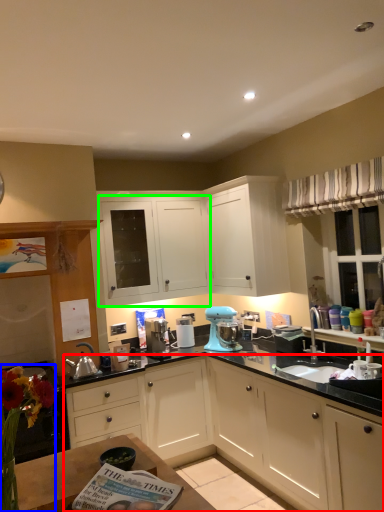
Question: Which is farther away from cabinetry (highlighted by a red box)? floral arrangement (highlighted by a blue box) or cabinetry (highlighted by a green box)?

Choices:
 (A) floral arrangement
 (B) cabinetry

Answer: (A)